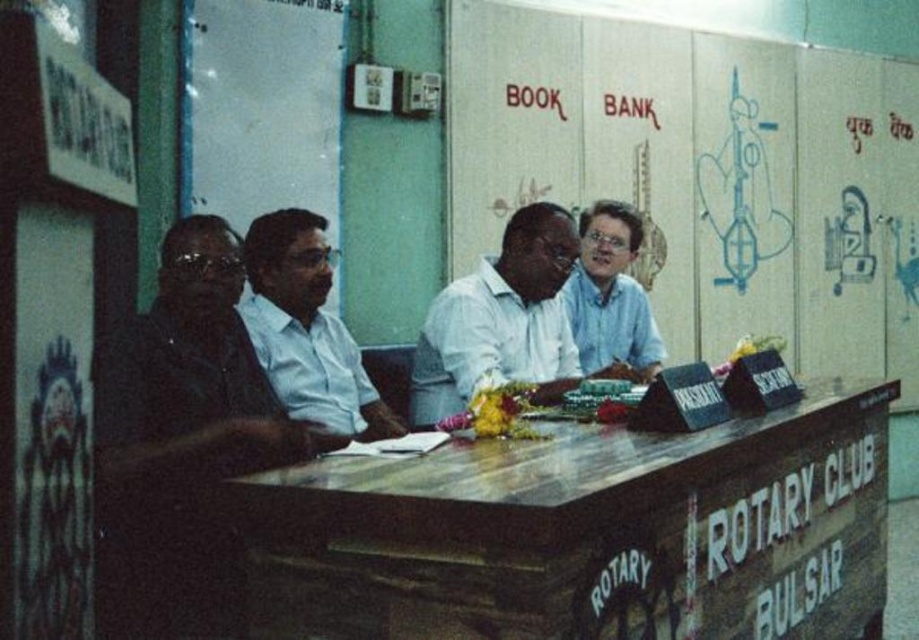
Question: Which object appears farthest from the camera in this image?

Choices:
 (A) white shirt at center
 (B) white matte shirt at center
 (C) matte white shirt at center
 (D) wooden at center

Answer: (A)

Question: Does matte white shirt at center lie in front of white shirt at center?

Choices:
 (A) yes
 (B) no

Answer: (A)

Question: Among these objects, which one is nearest to the camera?

Choices:
 (A) matte white shirt at center
 (B) wooden at center

Answer: (B)

Question: Which object appears farthest from the camera in this image?

Choices:
 (A) white shirt at center
 (B) wooden at center
 (C) matte white shirt at center
 (D) white matte shirt at center

Answer: (A)

Question: Is wooden at center smaller than matte white shirt at center?

Choices:
 (A) no
 (B) yes

Answer: (A)

Question: Considering the relative positions of white matte shirt at center and matte white shirt at center in the image provided, where is white matte shirt at center located with respect to matte white shirt at center?

Choices:
 (A) below
 (B) above

Answer: (A)